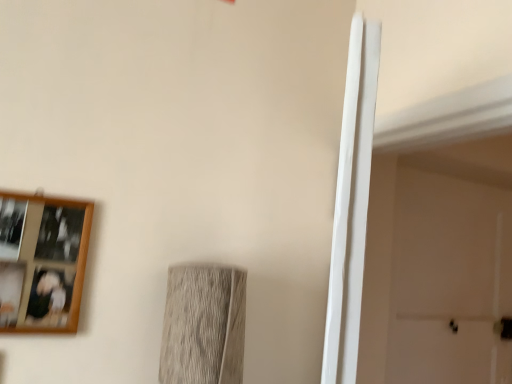
Question: Is white matte door at right positioned behind wooden picture frame at upper left?

Choices:
 (A) yes
 (B) no

Answer: (A)

Question: From the image's perspective, is white matte door at right under wooden picture frame at upper left?

Choices:
 (A) yes
 (B) no

Answer: (A)

Question: Is wooden picture frame at upper left at the back of white matte door at right?

Choices:
 (A) no
 (B) yes

Answer: (A)

Question: From a real-world perspective, is white matte door at right located higher than wooden picture frame at upper left?

Choices:
 (A) no
 (B) yes

Answer: (B)

Question: Does white matte door at right come in front of wooden picture frame at upper left?

Choices:
 (A) no
 (B) yes

Answer: (A)

Question: Is white matte door at right facing towards wooden picture frame at upper left?

Choices:
 (A) yes
 (B) no

Answer: (B)

Question: From the image's perspective, is wooden picture frame at upper left over white matte door at right?

Choices:
 (A) yes
 (B) no

Answer: (A)

Question: Is wooden picture frame at upper left aimed at white matte door at right?

Choices:
 (A) no
 (B) yes

Answer: (A)

Question: Is wooden picture frame at upper left positioned beyond the bounds of white matte door at right?

Choices:
 (A) yes
 (B) no

Answer: (A)

Question: Does wooden picture frame at upper left appear on the left side of white matte door at right?

Choices:
 (A) yes
 (B) no

Answer: (A)

Question: From the image's perspective, is wooden picture frame at upper left located beneath white matte door at right?

Choices:
 (A) no
 (B) yes

Answer: (A)

Question: From a real-world perspective, does wooden picture frame at upper left sit lower than white matte door at right?

Choices:
 (A) no
 (B) yes

Answer: (B)

Question: Choose the correct answer: Is wooden picture frame at upper left inside white matte door at right or outside it?

Choices:
 (A) inside
 (B) outside

Answer: (B)